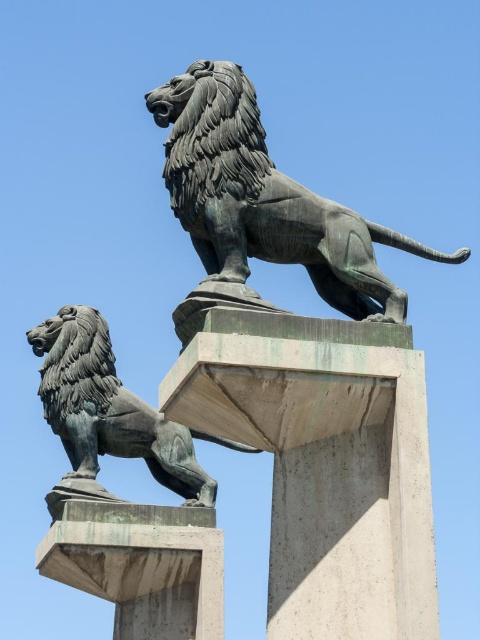
In the scene shown: Who is positioned more to the left, bronze lion at upper center or concrete at center?

Positioned to the left is concrete at center.

The image size is (480, 640). What do you see at coordinates (265, 198) in the screenshot?
I see `bronze lion at upper center` at bounding box center [265, 198].

Describe the element at coordinates (265, 198) in the screenshot. I see `bronze lion at upper center` at that location.

Where is `bronze lion at upper center`? bronze lion at upper center is located at coordinates (265, 198).

Can you confirm if bronze lion at upper center is positioned above bronze lion at lower left?

Yes.

The height and width of the screenshot is (640, 480). What do you see at coordinates (265, 198) in the screenshot?
I see `bronze lion at upper center` at bounding box center [265, 198].

Locate an element on the screen. bronze lion at upper center is located at coordinates (265, 198).

Between sanded concrete pillar at center and concrete at center, which one is positioned higher?

sanded concrete pillar at center

Which is behind, point (253, 326) or point (195, 616)?

The point (195, 616) is more distant.

At what (x,y) coordinates should I click in order to perform the action: click on sanded concrete pillar at center. Please return your answer as a coordinate pair (x, y). Looking at the image, I should click on (325, 464).